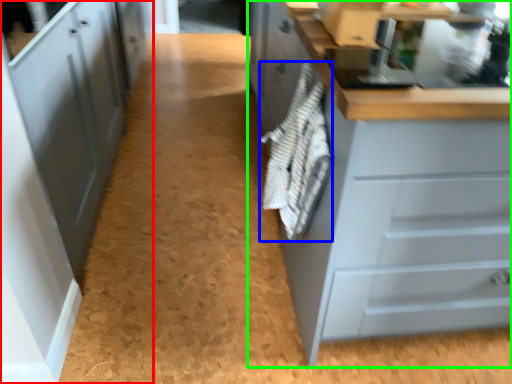
Question: Which is nearer to the cabinetry (highlighted by a red box)? material (highlighted by a blue box) or cabinetry (highlighted by a green box).

Choices:
 (A) material
 (B) cabinetry

Answer: (A)